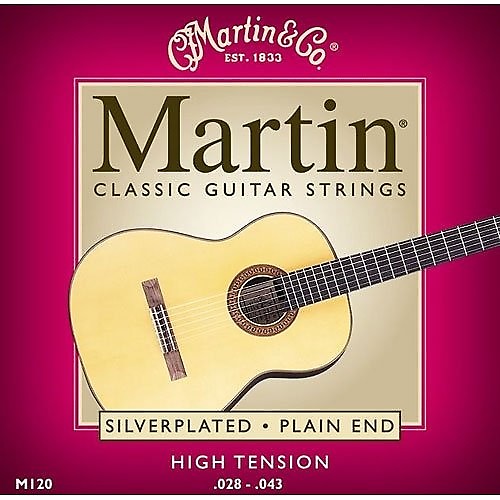
The height and width of the screenshot is (500, 500). In order to click on frame in this screenshot , I will do `click(383, 412)`, `click(424, 411)`.